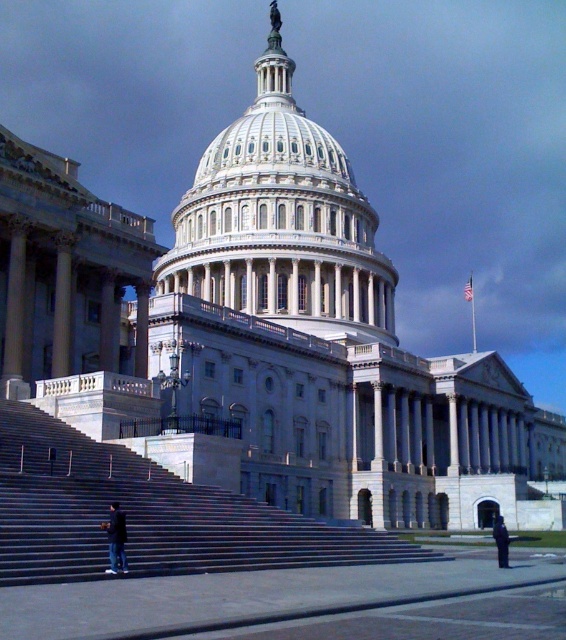
You are standing in front of the United States Capitol building and see two people wearing dark blue jeans at lower left and dark blue uniform at lower right. Which person is closer to the Capitol building?

The dark blue jeans at lower left is located above the dark blue uniform at lower right, meaning it is closer to the Capitol building.

What is the spatial relationship between the gray concrete stairs at lower left and the United States Capitol building?

The gray concrete stairs at lower left are located at point coordinates of (147, 515) relative to the image frame, positioning them at the lower left area near the Capitol building.